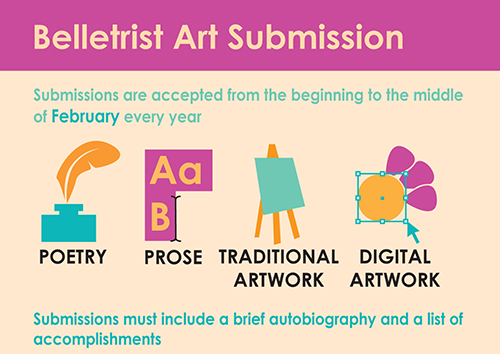
The width and height of the screenshot is (500, 354). Find the location of `graphic of an art board on a stand`. graphic of an art board on a stand is located at coordinates (282, 189).